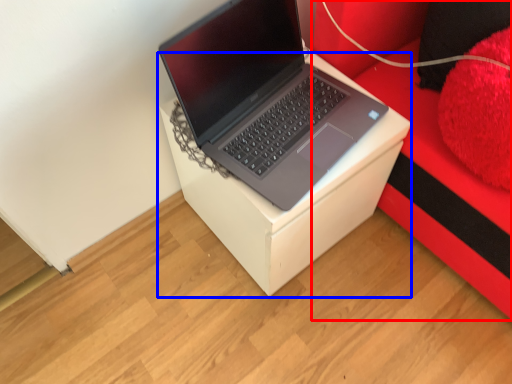
Question: Which object is further to the camera taking this photo, furniture (highlighted by a red box) or table (highlighted by a blue box)?

Choices:
 (A) furniture
 (B) table

Answer: (B)